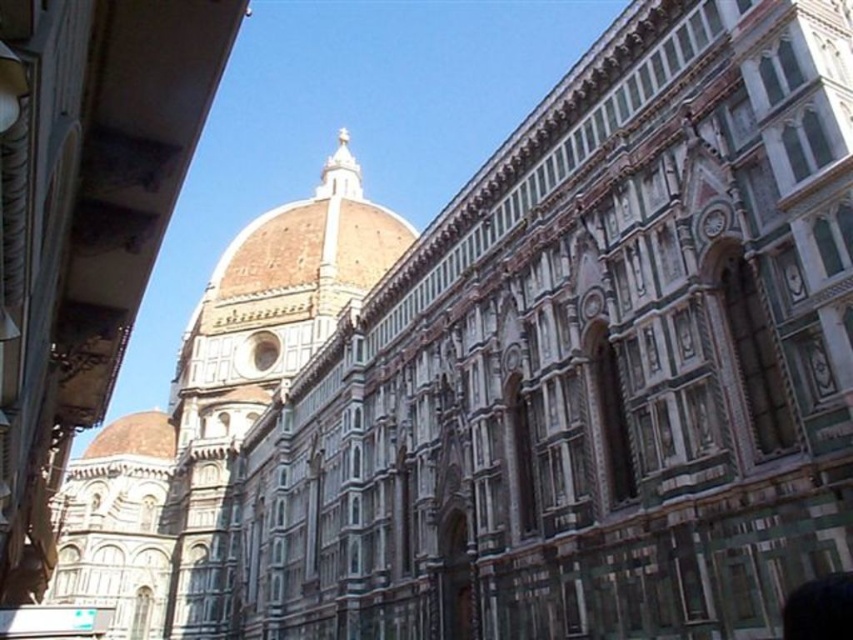
You are a tourist standing at the base of the Florence Cathedral. You notice the brown marble dome at center and the white marble tower at center. Which structure is positioned higher in the image?

The brown marble dome at center is located above the white marble tower at center, so it is positioned higher in the image.

You are standing in front of the Florence Cathedral and notice two points marked on the dome. The first point is at coordinates point (129, 476) and the second is at point (144, 452). Which point is nearer to your current position?

Point (129, 476) is closer to the camera than point (144, 452), so the first point is nearer to your current position.